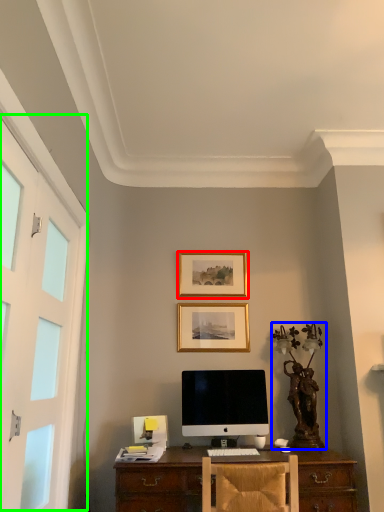
Question: Based on their relative distances, which object is nearer to picture frame (highlighted by a red box)? Choose from antique (highlighted by a blue box) and screen door (highlighted by a green box).

Choices:
 (A) antique
 (B) screen door

Answer: (A)